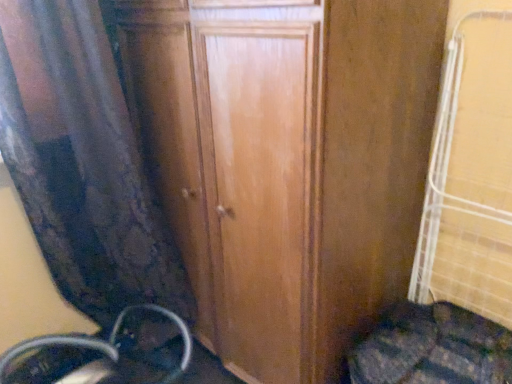
Question: From the image's perspective, is velvet curtain at left beneath metallic silver wheel at lower left?

Choices:
 (A) yes
 (B) no

Answer: (B)

Question: Considering the relative sizes of velvet curtain at left and metallic silver wheel at lower left in the image provided, is velvet curtain at left thinner than metallic silver wheel at lower left?

Choices:
 (A) yes
 (B) no

Answer: (A)

Question: Is velvet curtain at left closer to camera compared to metallic silver wheel at lower left?

Choices:
 (A) yes
 (B) no

Answer: (A)

Question: Is velvet curtain at left looking in the opposite direction of metallic silver wheel at lower left?

Choices:
 (A) yes
 (B) no

Answer: (A)

Question: From the image's perspective, is velvet curtain at left located above metallic silver wheel at lower left?

Choices:
 (A) no
 (B) yes

Answer: (B)

Question: Is velvet curtain at left far away from metallic silver wheel at lower left?

Choices:
 (A) no
 (B) yes

Answer: (A)

Question: Is velvet curtain at left oriented away from wooden door at center?

Choices:
 (A) no
 (B) yes

Answer: (A)

Question: Is there a large distance between velvet curtain at left and wooden door at center?

Choices:
 (A) yes
 (B) no

Answer: (B)

Question: Does velvet curtain at left touch wooden door at center?

Choices:
 (A) no
 (B) yes

Answer: (A)

Question: Is wooden door at center inside velvet curtain at left?

Choices:
 (A) yes
 (B) no

Answer: (B)

Question: Does velvet curtain at left have a larger size compared to wooden door at center?

Choices:
 (A) no
 (B) yes

Answer: (A)

Question: Considering the relative positions of velvet curtain at left and wooden door at center in the image provided, is velvet curtain at left to the left of wooden door at center from the viewer's perspective?

Choices:
 (A) yes
 (B) no

Answer: (A)

Question: Does wooden door at center have a larger size compared to velvet curtain at left?

Choices:
 (A) yes
 (B) no

Answer: (A)